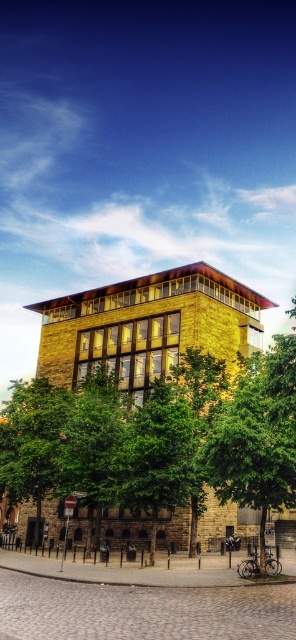
You are standing in front of the modern building and want to know which tree is taller between the green leafy tree at center and the green leafy tree at lower left. Can you determine this based on the scene?

The green leafy tree at lower left is taller than the green leafy tree at center.

Based on the photo, you are standing on the sidewalk in front of the modern building. You notice two green leafy trees. Which tree, the green leafy tree at center or the green leafy tree at lower left, is positioned higher up relative to the building?

The green leafy tree at center is positioned higher up relative to the building than the green leafy tree at lower left because it is above it according to the description.